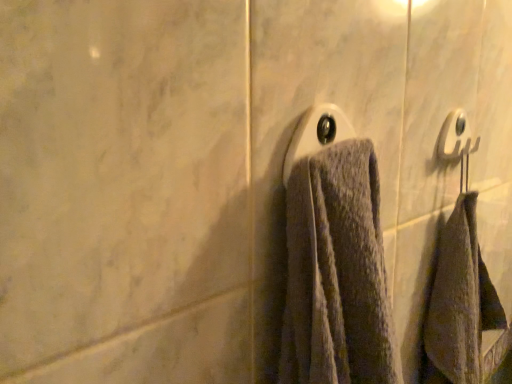
Question: Which direction should I rotate to face white plastic towel bar at center, the second towel bar when ordered from back to front, — up or down?

Choices:
 (A) down
 (B) up

Answer: (B)

Question: Is the depth of white plastic towel bar at center, the second towel bar when ordered from back to front, greater than that of white plastic towel bar at upper right, arranged as the 2th towel bar when viewed from the left?

Choices:
 (A) yes
 (B) no

Answer: (B)

Question: Can you confirm if white plastic towel bar at center, which ranks as the first towel bar in left-to-right order, is positioned to the left of white plastic towel bar at upper right, the 2th towel bar in the front-to-back sequence?

Choices:
 (A) no
 (B) yes

Answer: (B)

Question: From a real-world perspective, does white plastic towel bar at center, which ranks as the first towel bar in left-to-right order, sit lower than white plastic towel bar at upper right, which appears as the 1th towel bar when viewed from the right?

Choices:
 (A) yes
 (B) no

Answer: (B)

Question: Is white plastic towel bar at center, which ranks as the second towel bar in right-to-left order, oriented away from white plastic towel bar at upper right, which appears as the 1th towel bar when viewed from the back?

Choices:
 (A) yes
 (B) no

Answer: (B)

Question: Are white plastic towel bar at center, the second towel bar when ordered from back to front, and white plastic towel bar at upper right, the 2th towel bar in the front-to-back sequence, far apart?

Choices:
 (A) no
 (B) yes

Answer: (A)

Question: Is white plastic towel bar at center, which ranks as the first towel bar in left-to-right order, at the right side of white plastic towel bar at upper right, arranged as the 2th towel bar when viewed from the left?

Choices:
 (A) yes
 (B) no

Answer: (B)

Question: Does white plastic towel bar at upper right, which appears as the 1th towel bar when viewed from the right, appear on the right side of white plastic towel bar at center, the second towel bar when ordered from back to front?

Choices:
 (A) yes
 (B) no

Answer: (A)

Question: Considering the relative sizes of white plastic towel bar at upper right, arranged as the 2th towel bar when viewed from the left, and white plastic towel bar at center, which ranks as the first towel bar in left-to-right order, in the image provided, is white plastic towel bar at upper right, arranged as the 2th towel bar when viewed from the left, thinner than white plastic towel bar at center, which ranks as the first towel bar in left-to-right order,?

Choices:
 (A) yes
 (B) no

Answer: (A)

Question: Does white plastic towel bar at upper right, arranged as the 2th towel bar when viewed from the left, have a larger size compared to white plastic towel bar at center, which ranks as the second towel bar in right-to-left order?

Choices:
 (A) yes
 (B) no

Answer: (B)

Question: Is white plastic towel bar at upper right, arranged as the 2th towel bar when viewed from the left, looking in the opposite direction of white plastic towel bar at center, which ranks as the first towel bar in left-to-right order?

Choices:
 (A) no
 (B) yes

Answer: (A)

Question: Is white plastic towel bar at upper right, which appears as the 1th towel bar when viewed from the right, placed right next to white plastic towel bar at center, the second towel bar when ordered from back to front?

Choices:
 (A) yes
 (B) no

Answer: (B)

Question: Is the depth of white plastic towel bar at upper right, the 2th towel bar in the front-to-back sequence, greater than that of white plastic towel bar at center, which ranks as the first towel bar in left-to-right order?

Choices:
 (A) no
 (B) yes

Answer: (B)

Question: Looking at their shapes, would you say white plastic towel bar at upper right, which appears as the 1th towel bar when viewed from the back, is wider or thinner than white plastic towel bar at center, the 1th towel bar from the front?

Choices:
 (A) wide
 (B) thin

Answer: (B)